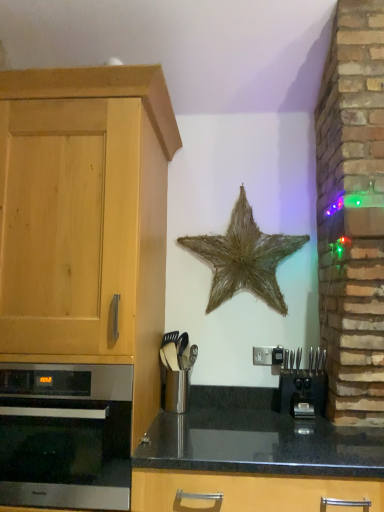
Question: Is satin silver oven at left located outside black granite countertop at center?

Choices:
 (A) no
 (B) yes

Answer: (B)

Question: Does satin silver oven at left have a lesser width compared to black granite countertop at center?

Choices:
 (A) no
 (B) yes

Answer: (B)

Question: Is satin silver oven at left taller than black granite countertop at center?

Choices:
 (A) no
 (B) yes

Answer: (A)

Question: Is satin silver oven at left behind black granite countertop at center?

Choices:
 (A) yes
 (B) no

Answer: (A)

Question: Does satin silver oven at left have a lesser height compared to black granite countertop at center?

Choices:
 (A) no
 (B) yes

Answer: (B)

Question: Considering the positions of point (291, 404) and point (192, 349), is point (291, 404) closer or farther from the camera than point (192, 349)?

Choices:
 (A) closer
 (B) farther

Answer: (A)

Question: Is black plastic coffee machine at lower right inside or outside of metallic silver utensil holder at center?

Choices:
 (A) outside
 (B) inside

Answer: (A)

Question: Relative to metallic silver utensil holder at center, is black plastic coffee machine at lower right in front or behind?

Choices:
 (A) behind
 (B) front

Answer: (B)

Question: From a real-world perspective, relative to metallic silver utensil holder at center, is black plastic coffee machine at lower right vertically above or below?

Choices:
 (A) above
 (B) below

Answer: (B)

Question: Does point [157, 418] appear closer or farther from the camera than point [228, 249]?

Choices:
 (A) closer
 (B) farther

Answer: (A)

Question: Is black granite countertop at center inside the boundaries of rustic straw star at center, or outside?

Choices:
 (A) inside
 (B) outside

Answer: (B)

Question: Considering the positions of black granite countertop at center and rustic straw star at center in the image, is black granite countertop at center taller or shorter than rustic straw star at center?

Choices:
 (A) short
 (B) tall

Answer: (A)

Question: Is black granite countertop at center in front of or behind rustic straw star at center in the image?

Choices:
 (A) front
 (B) behind

Answer: (A)

Question: Based on their sizes in the image, would you say metallic silver utensil holder at center is bigger or smaller than black granite countertop at center?

Choices:
 (A) big
 (B) small

Answer: (B)

Question: Would you say metallic silver utensil holder at center is inside or outside black granite countertop at center?

Choices:
 (A) inside
 (B) outside

Answer: (A)